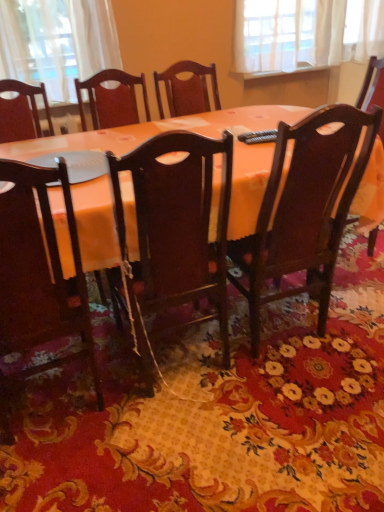
Question: Can you confirm if matte dark wood chair at lower left, the 3th chair in the right-to-left sequence, is wider than wooden chair at center, placed as the second chair when sorted from right to left?

Choices:
 (A) yes
 (B) no

Answer: (B)

Question: From a real-world perspective, is matte dark wood chair at lower left, the 3th chair in the right-to-left sequence, on top of wooden chair at center, placed as the second chair when sorted from right to left?

Choices:
 (A) yes
 (B) no

Answer: (B)

Question: Considering the relative sizes of matte dark wood chair at lower left, marked as the 1th chair in a left-to-right arrangement, and wooden chair at center, which appears as the second chair when viewed from the left, in the image provided, is matte dark wood chair at lower left, marked as the 1th chair in a left-to-right arrangement, thinner than wooden chair at center, which appears as the second chair when viewed from the left,?

Choices:
 (A) yes
 (B) no

Answer: (A)

Question: Is matte dark wood chair at lower left, marked as the 1th chair in a left-to-right arrangement, to the right of wooden chair at center, placed as the second chair when sorted from right to left, from the viewer's perspective?

Choices:
 (A) yes
 (B) no

Answer: (B)

Question: Is matte dark wood chair at lower left, the 3th chair in the right-to-left sequence, positioned in front of wooden chair at center, which appears as the second chair when viewed from the left?

Choices:
 (A) no
 (B) yes

Answer: (B)

Question: Can wooden chair at center, which appears as the second chair when viewed from the left, be found inside matte dark wood chair at lower left, marked as the 1th chair in a left-to-right arrangement?

Choices:
 (A) yes
 (B) no

Answer: (B)

Question: From a real-world perspective, does matte orange table at center stand above wooden chair at center, which appears as the second chair when viewed from the left?

Choices:
 (A) no
 (B) yes

Answer: (A)

Question: Is matte orange table at center thinner than wooden chair at center, which appears as the second chair when viewed from the left?

Choices:
 (A) no
 (B) yes

Answer: (A)

Question: Does matte orange table at center have a larger size compared to wooden chair at center, placed as the second chair when sorted from right to left?

Choices:
 (A) no
 (B) yes

Answer: (B)

Question: Considering the relative positions of matte orange table at center and wooden chair at center, which appears as the second chair when viewed from the left, in the image provided, is matte orange table at center to the left of wooden chair at center, which appears as the second chair when viewed from the left, from the viewer's perspective?

Choices:
 (A) yes
 (B) no

Answer: (B)

Question: From a real-world perspective, is matte orange table at center under wooden chair at center, which appears as the second chair when viewed from the left?

Choices:
 (A) no
 (B) yes

Answer: (B)

Question: Considering the relative sizes of matte orange table at center and wooden chair at center, which appears as the second chair when viewed from the left, in the image provided, is matte orange table at center wider than wooden chair at center, which appears as the second chair when viewed from the left,?

Choices:
 (A) yes
 (B) no

Answer: (A)

Question: Can you confirm if matte dark wood chair at lower left, marked as the 1th chair in a left-to-right arrangement, is taller than polished dark wood chair at center, the first chair viewed from the right?

Choices:
 (A) yes
 (B) no

Answer: (B)